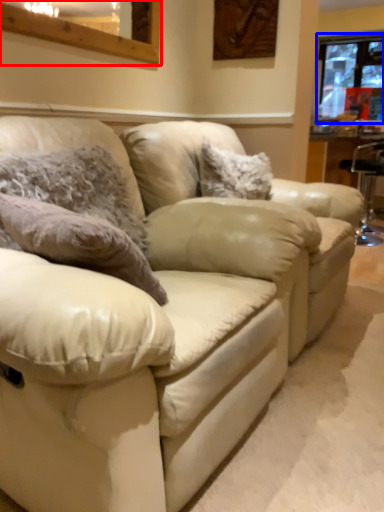
Question: Among these objects, which one is nearest to the camera, window (highlighted by a red box) or window (highlighted by a blue box)?

Choices:
 (A) window
 (B) window

Answer: (A)